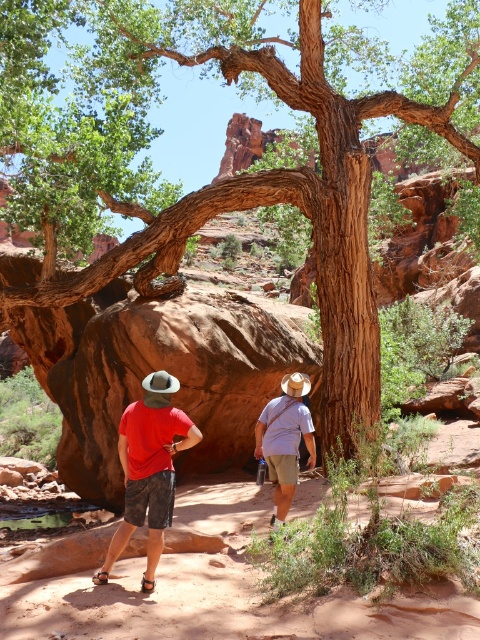
You are a photographer trying to capture both the matte red shirt at center and the light blue cotton shirt at center in the same frame. Which shirt should you focus on first to ensure both are in the shot?

The matte red shirt at center is positioned over the light blue cotton shirt at center, so you should focus on the matte red shirt at center first to ensure both are in the shot.

You are a hiker trying to locate your lost camouflage shorts in the desert. You remember that the last place you saw them was near a large, gnarled tree. According to the image, where exactly are the camouflage shorts at center located relative to the tree?

The camouflage shorts at center are located at point (148, 468) relative to the tree.